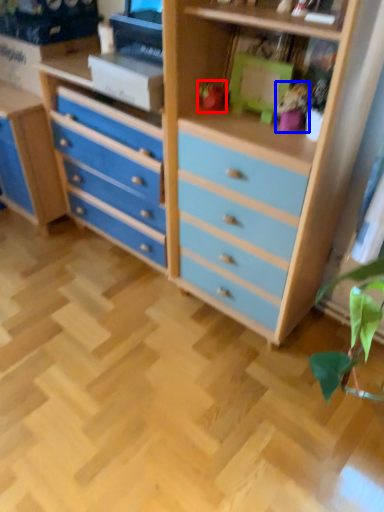
Question: Which of the following is the closest to the observer, toy (highlighted by a red box) or toy (highlighted by a blue box)?

Choices:
 (A) toy
 (B) toy

Answer: (B)